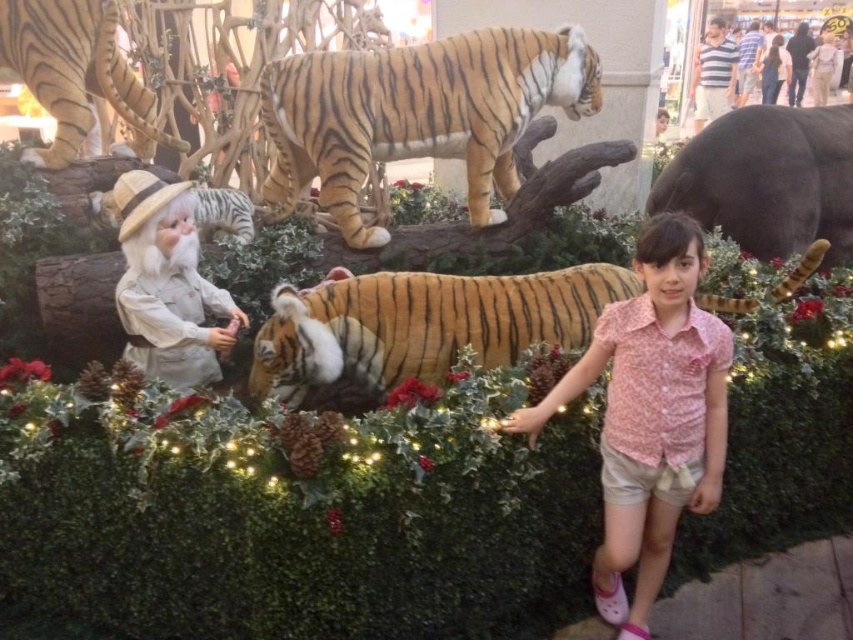
Can you confirm if orange-brown striped tiger at upper center is wider than white matte santa claus at left?

Correct, the width of orange-brown striped tiger at upper center exceeds that of white matte santa claus at left.

This screenshot has width=853, height=640. In order to click on orange-brown striped tiger at upper center in this screenshot , I will do `click(418, 113)`.

Is point (273, 93) farther from viewer compared to point (788, 218)?

No, (273, 93) is closer to viewer.

Which is more to the left, orange-brown striped tiger at upper center or smooth gray elephant at upper right?

orange-brown striped tiger at upper center is more to the left.

At what (x,y) coordinates should I click in order to perform the action: click on orange-brown striped tiger at upper center. Please return your answer as a coordinate pair (x, y). Looking at the image, I should click on (418, 113).

Is point (283, 116) positioned before point (120, 92)?

Yes, point (283, 116) is closer to viewer.

Identify the location of orange-brown striped tiger at upper center. This screenshot has height=640, width=853. (418, 113).

Describe the element at coordinates (418, 113) in the screenshot. Image resolution: width=853 pixels, height=640 pixels. I see `orange-brown striped tiger at upper center` at that location.

I want to click on orange-brown striped tiger at upper center, so click(x=418, y=113).